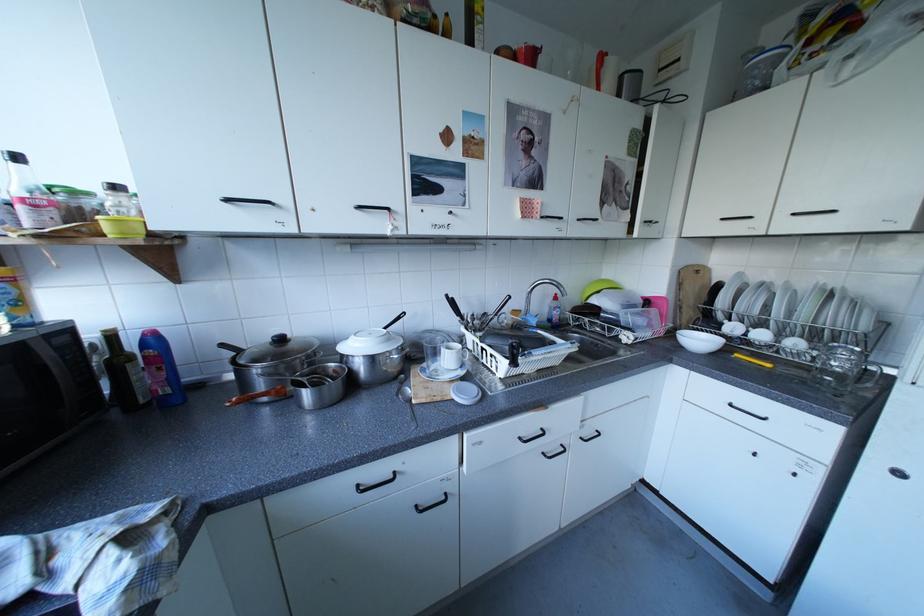
Find where to flip the blue bottle cap. Please return your answer as a coordinate pair (x, y).

(161, 369)